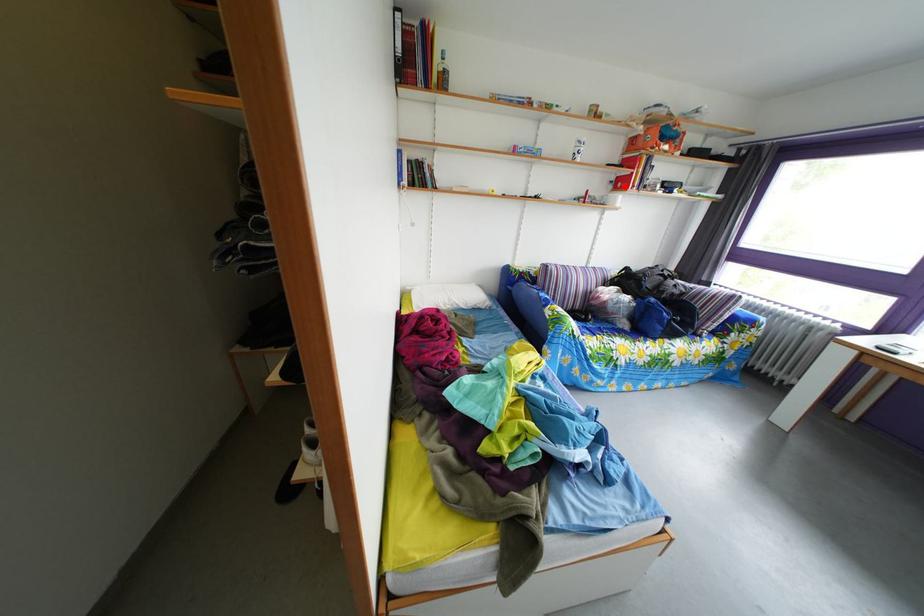
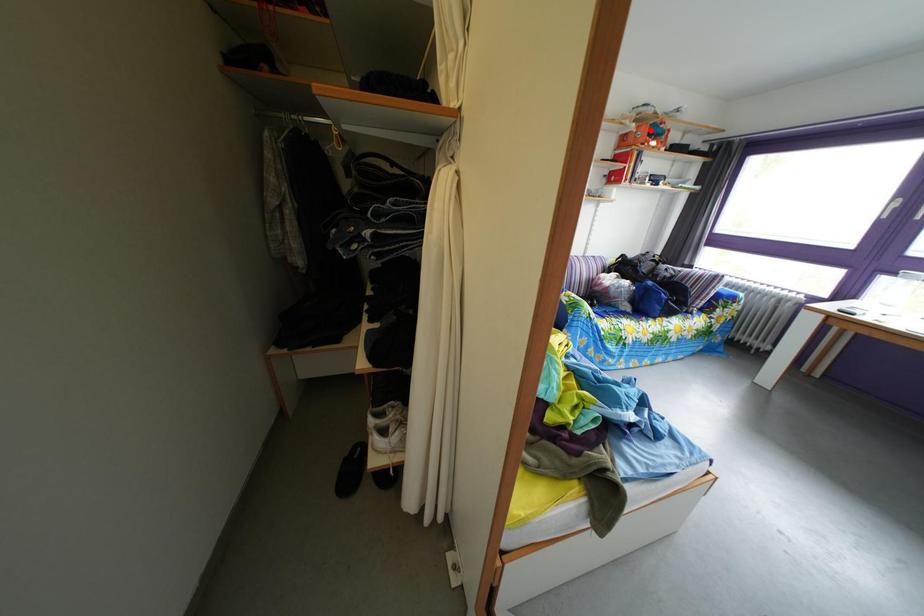
I am providing you with two images of the same scene from different viewpoints. A red point is marked on the first image and another point is marked on the second image. Does the point marked in image1 correspond to the same location as the one in image2?

No